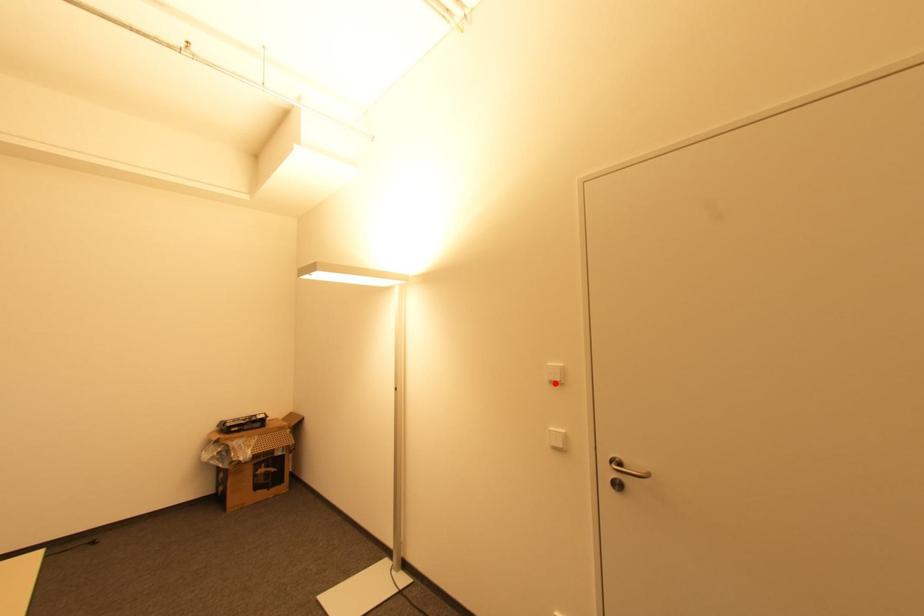
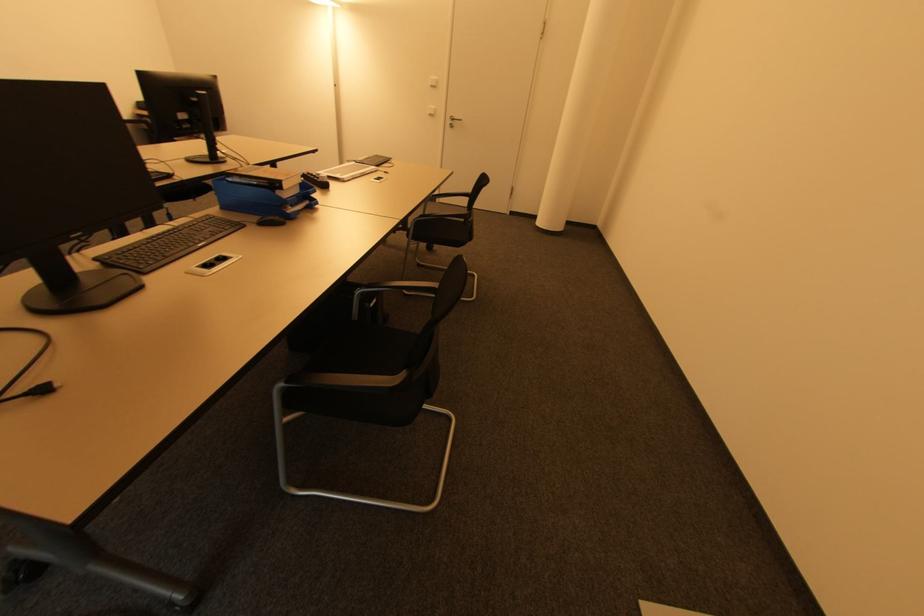
Question: I am providing you with two images of the same scene from different viewpoints. Image1 has a red point marked. In image2, the corresponding 3D location appears at what relative position? Reply with the corresponding letter.

Choices:
 (A) Closer
 (B) Farther

Answer: (A)